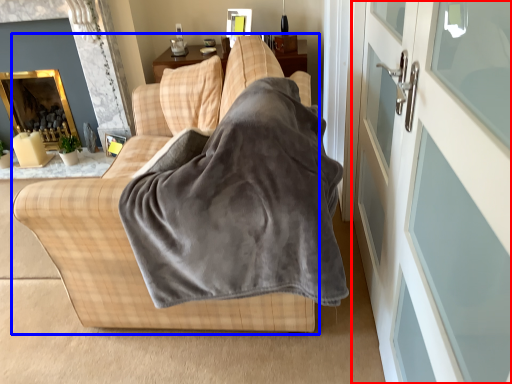
Question: Which object appears farthest to the camera in this image, screen door (highlighted by a red box) or studio couch (highlighted by a blue box)?

Choices:
 (A) screen door
 (B) studio couch

Answer: (B)